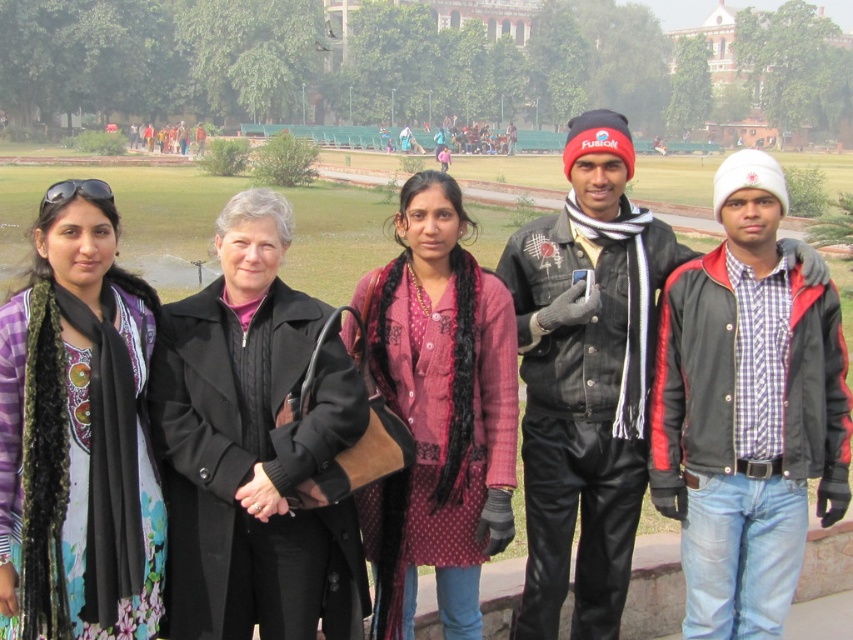
Question: Which point is farther from the camera taking this photo?

Choices:
 (A) (74, 584)
 (B) (430, 282)

Answer: (B)

Question: Is printed cotton dress at left bigger than rustic cotton kurti at center?

Choices:
 (A) no
 (B) yes

Answer: (A)

Question: Is printed cotton dress at left smaller than rustic cotton kurti at center?

Choices:
 (A) no
 (B) yes

Answer: (B)

Question: Does printed cotton dress at left have a greater width compared to rustic cotton kurti at center?

Choices:
 (A) no
 (B) yes

Answer: (A)

Question: Among these points, which one is nearest to the camera?

Choices:
 (A) (508, 484)
 (B) (47, 612)

Answer: (B)

Question: Among these points, which one is nearest to the camera?

Choices:
 (A) (19, 356)
 (B) (474, 532)

Answer: (A)